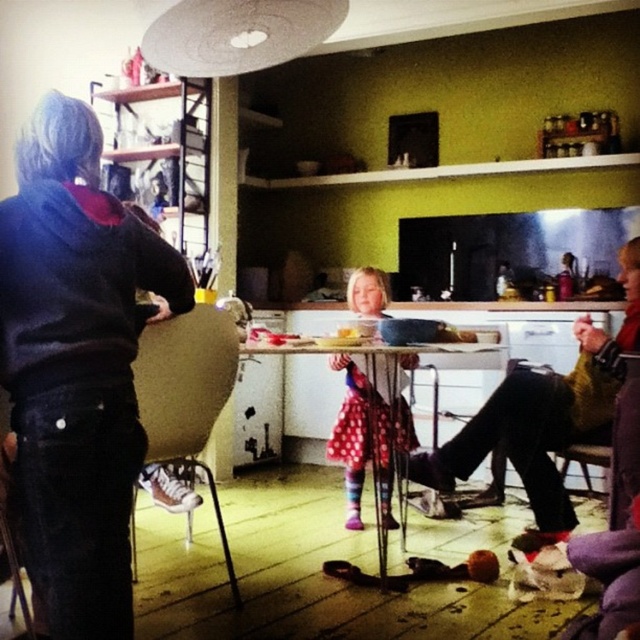
Question: Which point appears closest to the camera in this image?

Choices:
 (A) (134, 240)
 (B) (214, 355)
 (C) (497, 481)

Answer: (A)

Question: Does brown fabric chair at lower left appear on the left side of polka dot dress at center?

Choices:
 (A) yes
 (B) no

Answer: (A)

Question: Can you confirm if polka dot dress at center is positioned to the left of wooden chair at right?

Choices:
 (A) yes
 (B) no

Answer: (A)

Question: Considering the real-world distances, which object is farthest from the dark blue corduroy pants at left?

Choices:
 (A) brown fabric chair at lower left
 (B) wooden chair at right

Answer: (B)

Question: Considering the relative positions of dark blue corduroy pants at left and brown fabric chair at lower left in the image provided, where is dark blue corduroy pants at left located with respect to brown fabric chair at lower left?

Choices:
 (A) below
 (B) above

Answer: (B)

Question: Which of the following is the closest to the observer?

Choices:
 (A) dark blue corduroy pants at left
 (B) wooden chair at right
 (C) polka dot dress at center
 (D) brown fabric chair at lower left

Answer: (A)